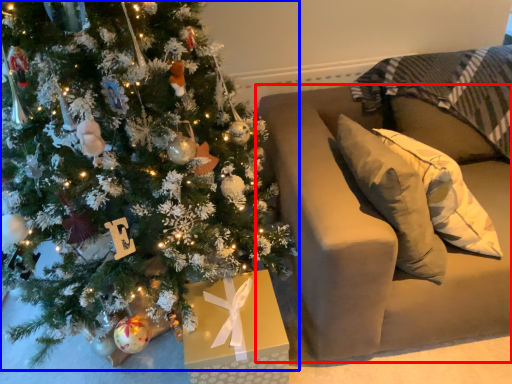
Question: Among these objects, which one is farthest to the camera, furniture (highlighted by a red box) or christmas tree (highlighted by a blue box)?

Choices:
 (A) furniture
 (B) christmas tree

Answer: (A)